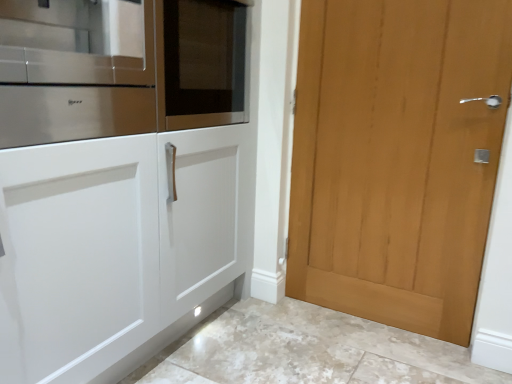
Where is `free space to the left of light brown wood door at right`? This screenshot has height=384, width=512. free space to the left of light brown wood door at right is located at coordinates (276, 332).